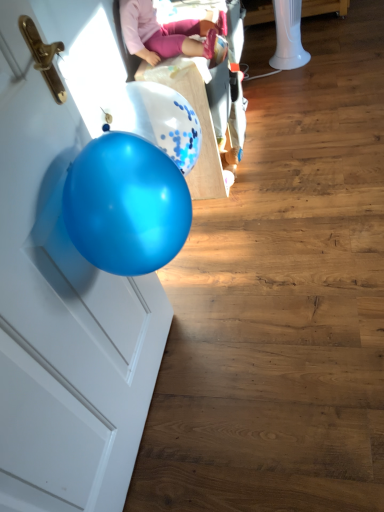
Where is `vacant region to the right of glossy blue balloon at left`? The width and height of the screenshot is (384, 512). vacant region to the right of glossy blue balloon at left is located at coordinates (257, 377).